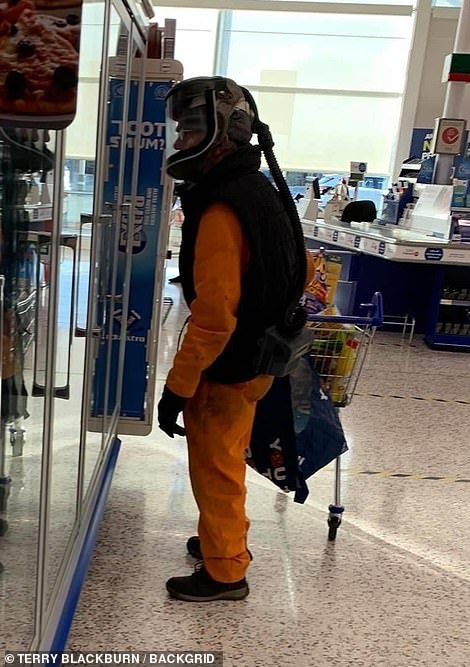
This screenshot has height=667, width=470. What are the coordinates of `window` in the screenshot? It's located at (342, 73).